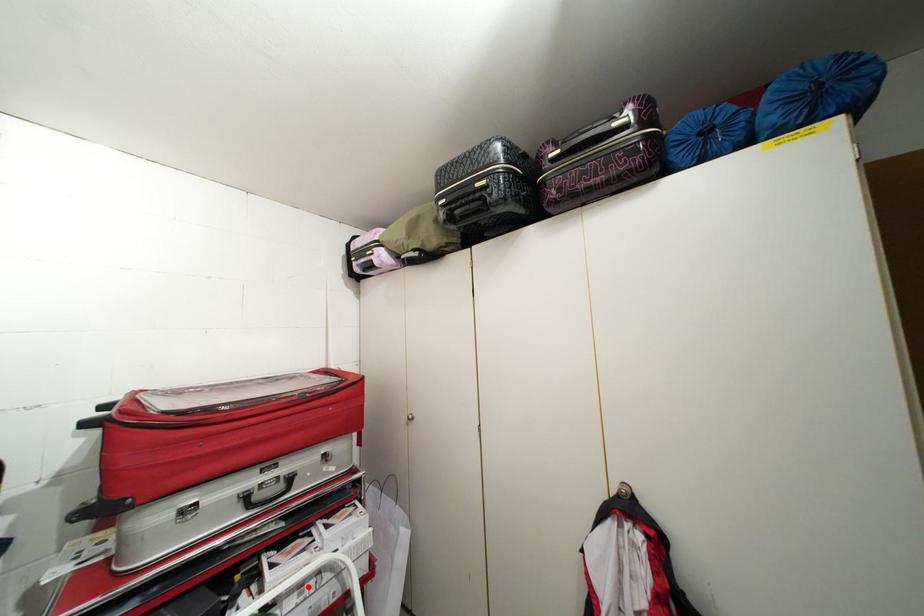
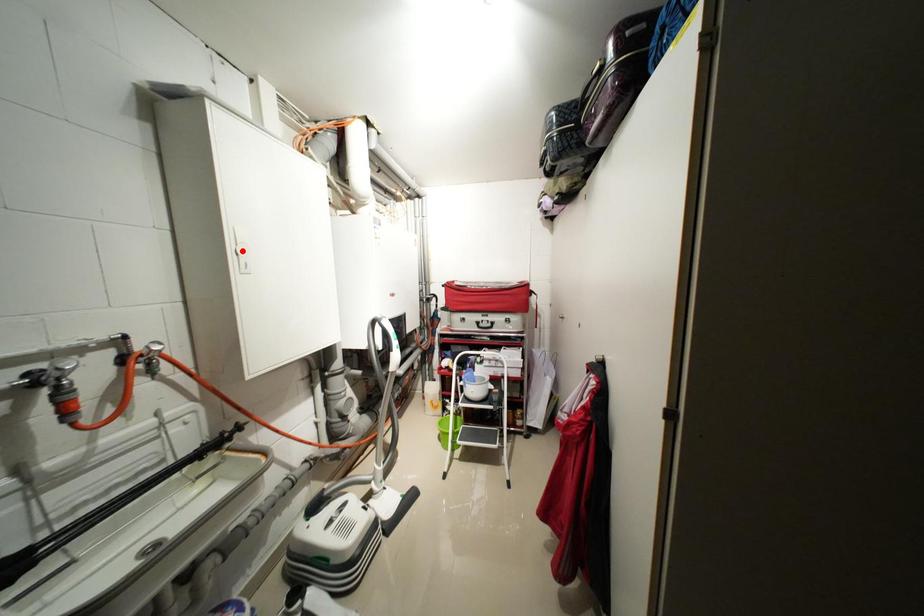
I am providing you with two images of the same scene from different viewpoints. A red point is marked on the first image and another point is marked on the second image. Does the point marked in image1 correspond to the same location as the one in image2?

No